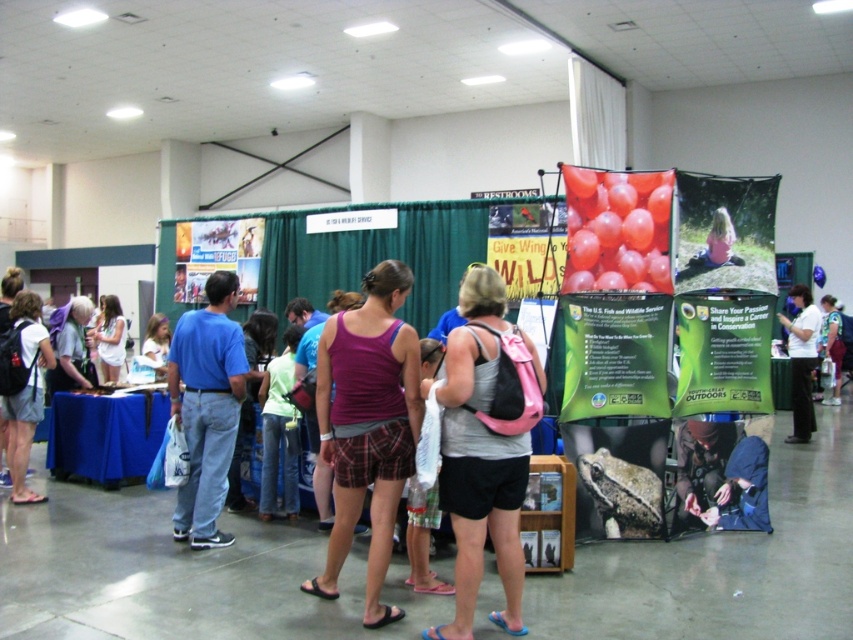
In the scene shown: You are an attendee at the event and you see two clothing items displayed at the USFWS booth. The white cotton dress at center and the matte purple tank top at center. Which clothing item is positioned higher?

The white cotton dress at center is above the matte purple tank top at center, so the white cotton dress at center is positioned higher.

You are a photographer at the event and need to capture a photo of both the white cotton dress at center and the matte purple tank top at center in the same frame. What is the minimum distance your camera needs to be from the two objects to include both in the shot?

The white cotton dress at center and the matte purple tank top at center are 1.23 meters apart. To include both in the same frame, the camera should be positioned at least 1.23 meters away from the closer object to ensure both are captured.